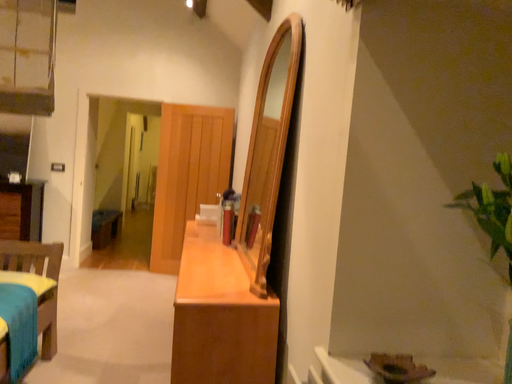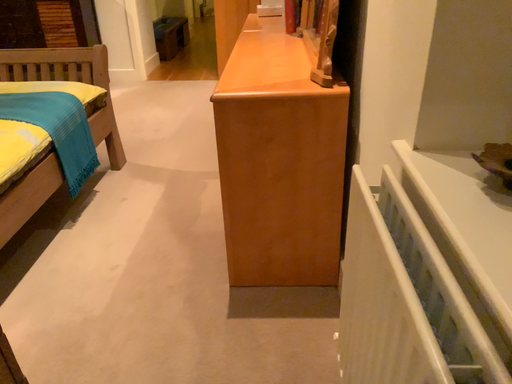
Question: Which way did the camera rotate in the video?

Choices:
 (A) rotated downward
 (B) rotated upward

Answer: (A)